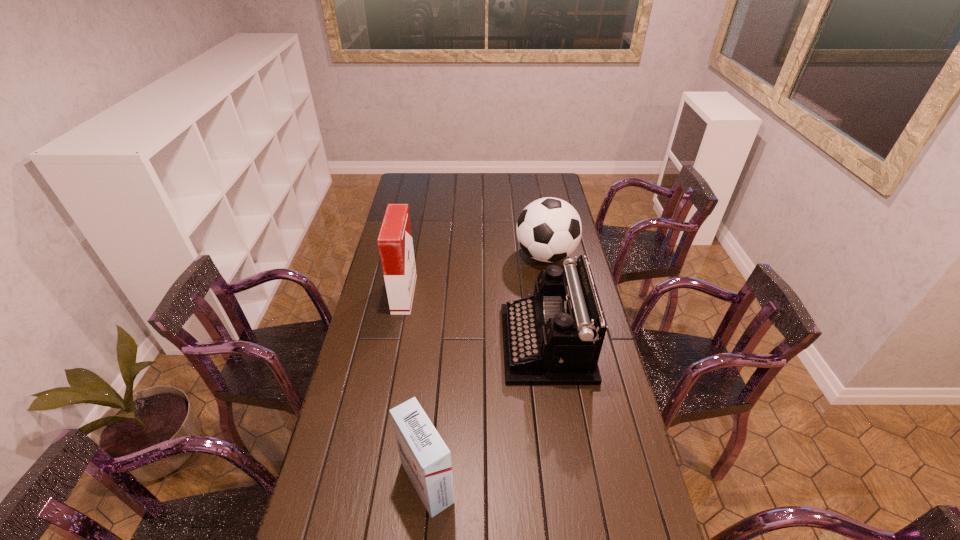
Locate an element on the screen. The height and width of the screenshot is (540, 960). the left cigarette case is located at coordinates (395, 243).

This screenshot has height=540, width=960. Identify the location of the farther cigarette case. (395, 243).

Where is `typewriter`? Image resolution: width=960 pixels, height=540 pixels. typewriter is located at coordinates (555, 337).

Where is `soccer ball`? soccer ball is located at coordinates (549, 229).

The width and height of the screenshot is (960, 540). In order to click on the shorter cigarette case in this screenshot , I will do `click(425, 457)`.

At what (x,y) coordinates should I click in order to perform the action: click on the second object from left to right. Please return your answer as a coordinate pair (x, y). The image size is (960, 540). Looking at the image, I should click on (425, 457).

Where is `vacant space situated 0.180m on the front-facing side of the tallest object`? The height and width of the screenshot is (540, 960). vacant space situated 0.180m on the front-facing side of the tallest object is located at coordinates (460, 294).

At what (x,y) coordinates should I click in order to perform the action: click on vacant space located on the typing side of the typewriter. Please return your answer as a coordinate pair (x, y). Looking at the image, I should click on click(445, 343).

You are a GUI agent. You are given a task and a screenshot of the screen. Output one action in this format:
    pyautogui.click(x=<x>, y=<y>)
    Task: Click on the vacant space situated on the typing side of the typewriter
    
    Given the screenshot: What is the action you would take?
    pyautogui.click(x=403, y=343)

Where is `vacant position located on the typing side of the typewriter`? Image resolution: width=960 pixels, height=540 pixels. vacant position located on the typing side of the typewriter is located at coordinates (400, 343).